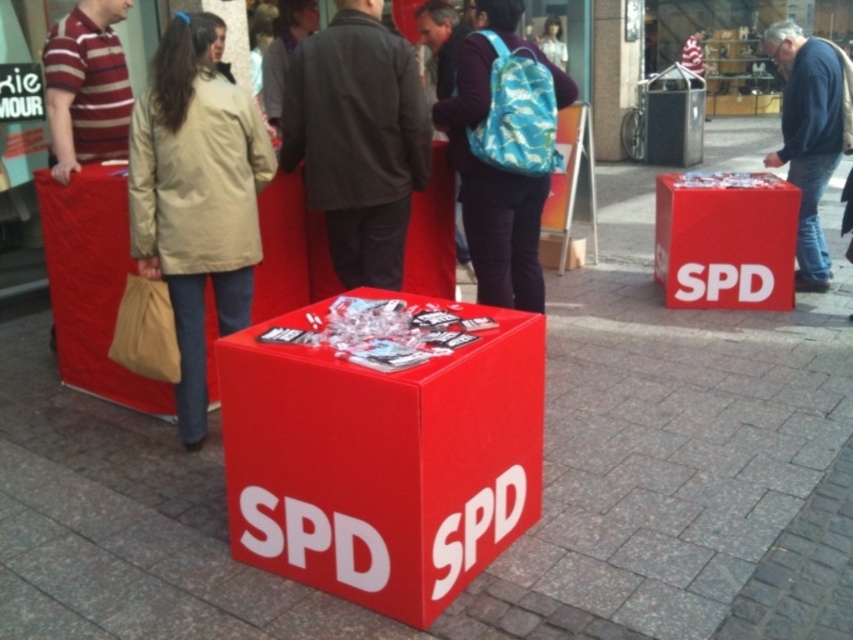
Which of these two, striped cotton shirt at left or matte blue backpack at center, stands taller?

striped cotton shirt at left is taller.

Can you confirm if striped cotton shirt at left is positioned above matte blue backpack at center?

Actually, striped cotton shirt at left is below matte blue backpack at center.

The width and height of the screenshot is (853, 640). What do you see at coordinates (86, 86) in the screenshot?
I see `striped cotton shirt at left` at bounding box center [86, 86].

Find the location of a particular element. striped cotton shirt at left is located at coordinates (86, 86).

Is red matte cube at center below matte blue backpack at center?

Indeed, red matte cube at center is positioned under matte blue backpack at center.

Between point (756, 292) and point (456, 32), which one is positioned behind?

Positioned behind is point (756, 292).

Is point (791, 221) farther from camera compared to point (462, 268)?

No, it is not.

Image resolution: width=853 pixels, height=640 pixels. I want to click on red matte cube at center, so click(x=724, y=240).

Can you confirm if dark gray jacket at center is positioned to the left of camo-patterned backpack at center?

Yes, dark gray jacket at center is to the left of camo-patterned backpack at center.

Does dark gray jacket at center come behind camo-patterned backpack at center?

No, dark gray jacket at center is closer to the viewer.

Between point (332, 182) and point (497, 296), which one is positioned in front?

Point (332, 182) is in front.

Find the location of a particular element. The height and width of the screenshot is (640, 853). dark gray jacket at center is located at coordinates 357,140.